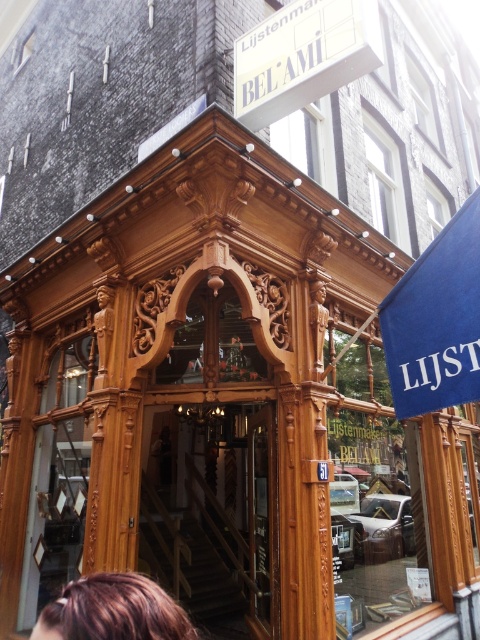
Question: Which of the following is the farthest from the observer?

Choices:
 (A) white plastic sign at upper center
 (B) wooden stairs at center

Answer: (B)

Question: Does white plastic sign at upper center appear on the left side of brown hair at lower left?

Choices:
 (A) no
 (B) yes

Answer: (A)

Question: Which of the following is the farthest from the observer?

Choices:
 (A) (74, 595)
 (B) (264, 484)

Answer: (B)

Question: Which is farther from the white plastic sign at upper center?

Choices:
 (A) brown hair at lower left
 (B) wooden stairs at center

Answer: (B)

Question: Does white plastic sign at upper center lie in front of brown hair at lower left?

Choices:
 (A) no
 (B) yes

Answer: (A)

Question: Does wooden stairs at center come in front of white plastic sign at upper center?

Choices:
 (A) no
 (B) yes

Answer: (A)